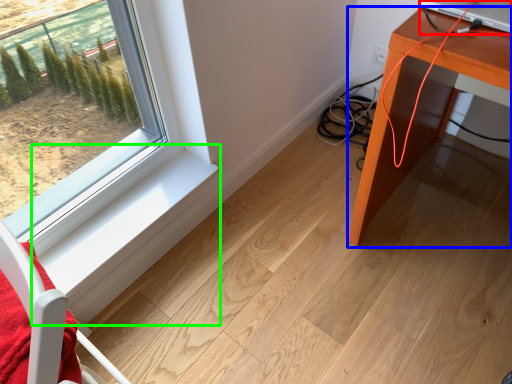
Question: Which is farther away from desktop computer (highlighted by a red box)? table (highlighted by a blue box) or window sill (highlighted by a green box)?

Choices:
 (A) table
 (B) window sill

Answer: (B)